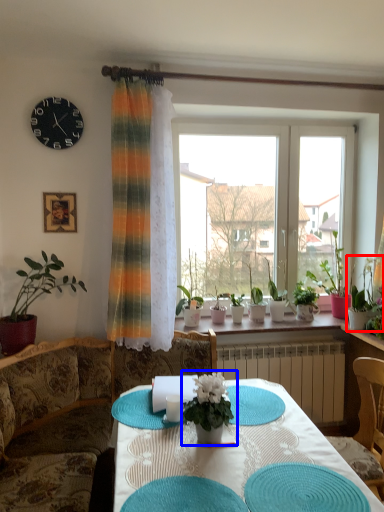
Question: Which of the following is the farthest to the observer, houseplant (highlighted by a red box) or houseplant (highlighted by a blue box)?

Choices:
 (A) houseplant
 (B) houseplant

Answer: (A)